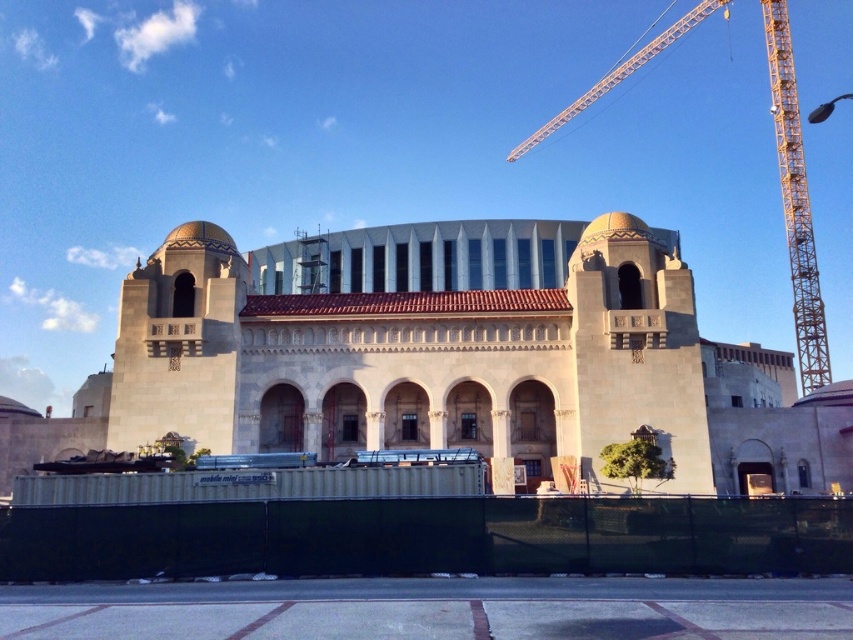
Question: Which object is farther from the camera taking this photo?

Choices:
 (A) beige stone building at center
 (B) yellow metal crane at upper right

Answer: (B)

Question: Is beige stone building at center positioned at the back of yellow metal crane at upper right?

Choices:
 (A) no
 (B) yes

Answer: (A)

Question: Can you confirm if beige stone building at center is wider than yellow metal crane at upper right?

Choices:
 (A) yes
 (B) no

Answer: (B)

Question: Where is beige stone building at center located in relation to yellow metal crane at upper right in the image?

Choices:
 (A) left
 (B) right

Answer: (A)